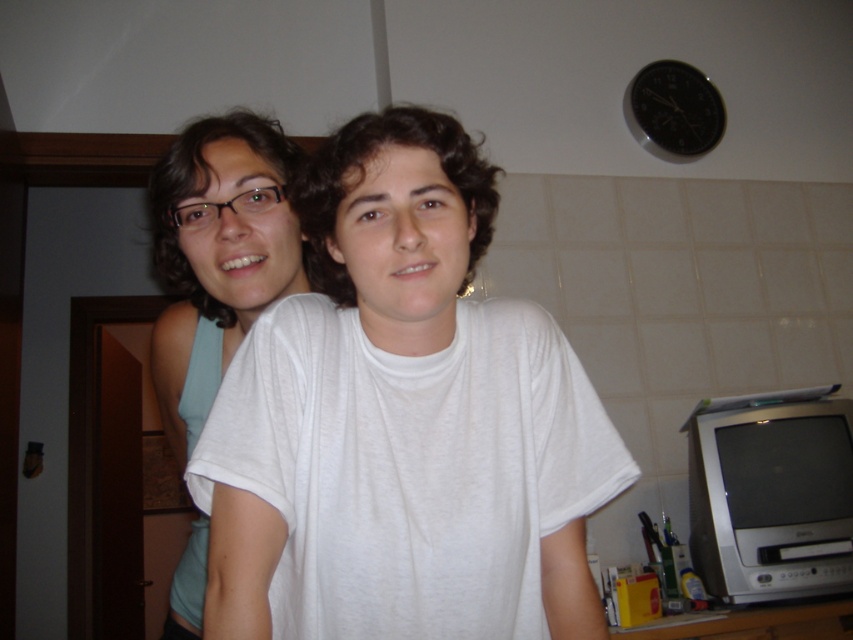
Is white cotton shirt at center below matte white t-shirt at left?

Actually, white cotton shirt at center is above matte white t-shirt at left.

Which is behind, point (476, 490) or point (151, 221)?

Point (151, 221)

This screenshot has height=640, width=853. What are the coordinates of `white cotton shirt at center` in the screenshot? It's located at (403, 420).